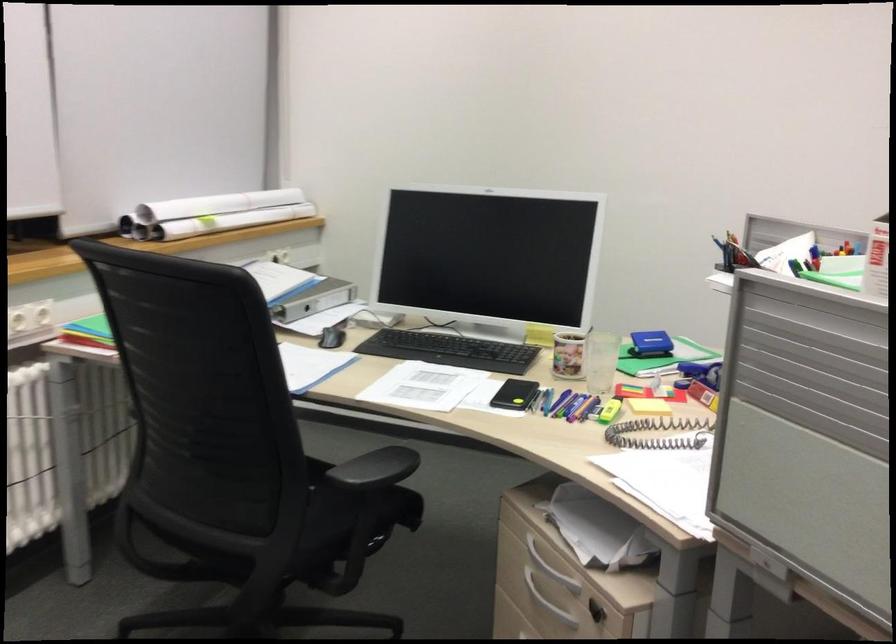
The width and height of the screenshot is (896, 644). What do you see at coordinates (596, 611) in the screenshot?
I see `a cabinet lock` at bounding box center [596, 611].